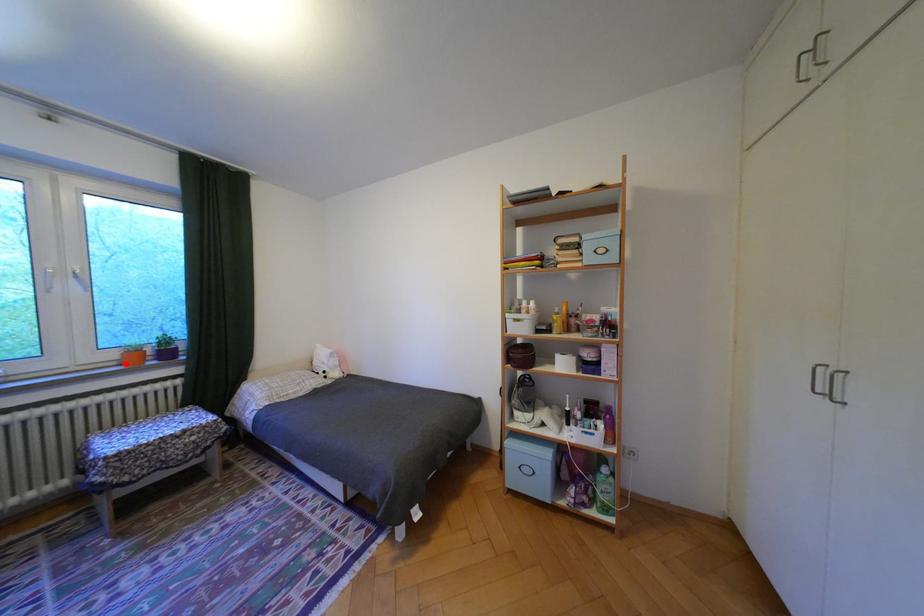
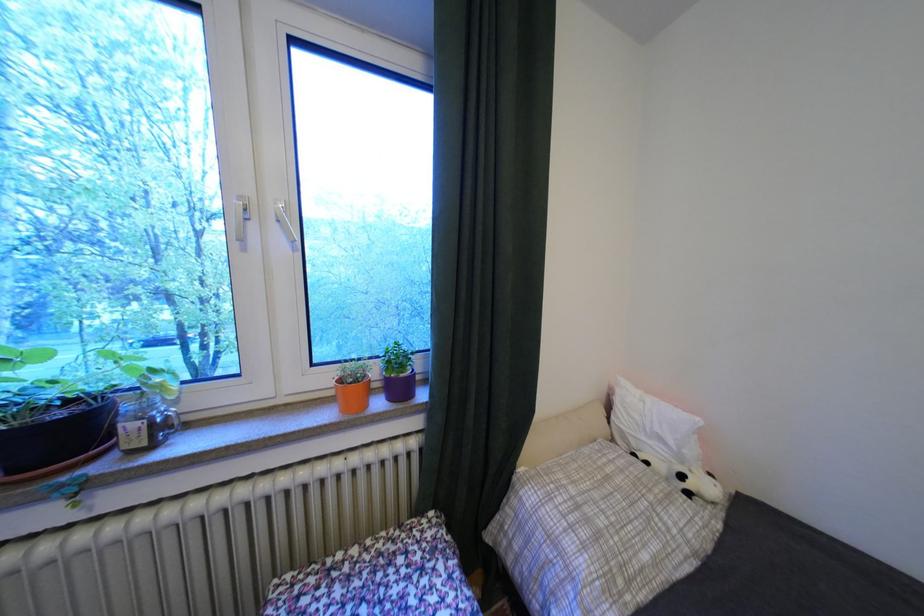
Find the pixel in the second image that matches the highlighted location in the first image.

(343, 392)